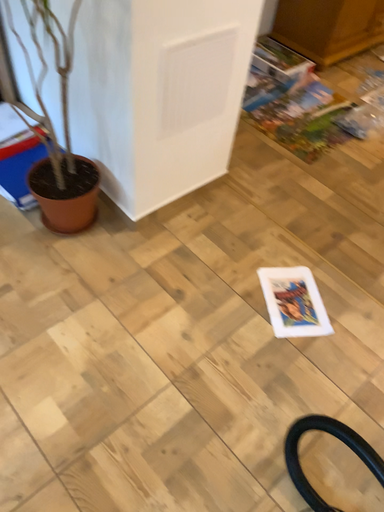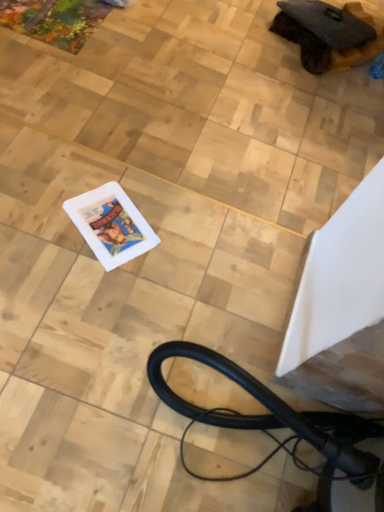
Question: How did the camera likely rotate when shooting the video?

Choices:
 (A) rotated left
 (B) rotated right

Answer: (B)